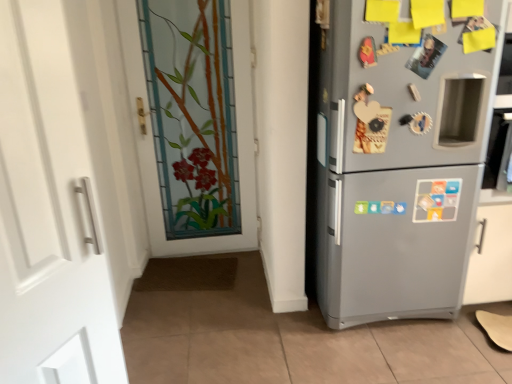
Question: Looking at their shapes, would you say white matte door at left, which ranks as the 2th door in right-to-left order, is wider or thinner than stained glass door at center, which appears as the 1th door when viewed from the back?

Choices:
 (A) wide
 (B) thin

Answer: (B)

Question: Is white matte door at left, the first door positioned from the front, situated inside stained glass door at center, acting as the 1th door starting from the right, or outside?

Choices:
 (A) inside
 (B) outside

Answer: (B)

Question: Estimate the real-world distances between objects in this image. Which object is farther from the stained glass door at center, which appears as the 1th door when viewed from the back?

Choices:
 (A) satin silver fridge at right
 (B) white matte door at left, the first door positioned from the front

Answer: (B)

Question: Estimate the real-world distances between objects in this image. Which object is closer to the satin silver fridge at right?

Choices:
 (A) white matte door at left, the 2th door from the back
 (B) stained glass door at center, which appears as the 1th door when viewed from the back

Answer: (B)